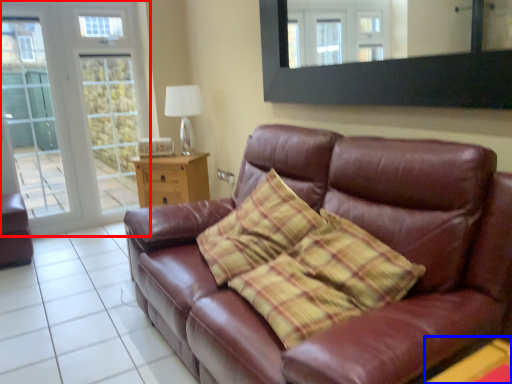
Question: Which object is further to the camera taking this photo, glass door (highlighted by a red box) or table (highlighted by a blue box)?

Choices:
 (A) glass door
 (B) table

Answer: (A)